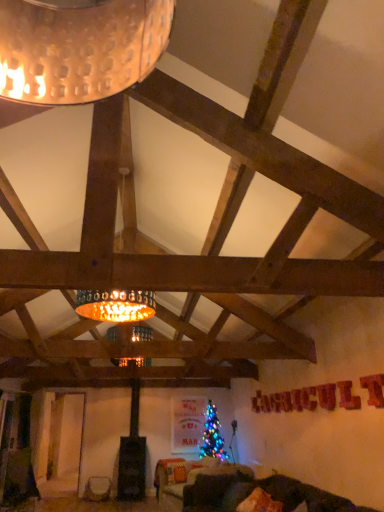
Question: Does velvet dark green couch at lower center have a larger size compared to matte white vase at lower left?

Choices:
 (A) yes
 (B) no

Answer: (A)

Question: Is velvet dark green couch at lower center outside of matte white vase at lower left?

Choices:
 (A) yes
 (B) no

Answer: (A)

Question: Does velvet dark green couch at lower center have a lesser height compared to matte white vase at lower left?

Choices:
 (A) yes
 (B) no

Answer: (B)

Question: Considering the relative positions of velvet dark green couch at lower center and matte white vase at lower left in the image provided, is velvet dark green couch at lower center to the left of matte white vase at lower left from the viewer's perspective?

Choices:
 (A) no
 (B) yes

Answer: (A)

Question: Could you tell me if velvet dark green couch at lower center is facing matte white vase at lower left?

Choices:
 (A) no
 (B) yes

Answer: (A)

Question: Relative to matte white vase at lower left, is velvet orange pillow at lower center in front or behind?

Choices:
 (A) front
 (B) behind

Answer: (A)

Question: Does point (279, 503) appear closer or farther from the camera than point (87, 500)?

Choices:
 (A) closer
 (B) farther

Answer: (A)

Question: Would you say velvet orange pillow at lower center is inside or outside matte white vase at lower left?

Choices:
 (A) outside
 (B) inside

Answer: (A)

Question: Is velvet orange pillow at lower center taller or shorter than matte white vase at lower left?

Choices:
 (A) short
 (B) tall

Answer: (A)

Question: Looking at the image, does matte white vase at lower left seem bigger or smaller compared to velvet dark green couch at lower center?

Choices:
 (A) big
 (B) small

Answer: (B)

Question: From a real-world perspective, is matte white vase at lower left positioned above or below velvet dark green couch at lower center?

Choices:
 (A) below
 (B) above

Answer: (A)

Question: In terms of width, does matte white vase at lower left look wider or thinner when compared to velvet dark green couch at lower center?

Choices:
 (A) thin
 (B) wide

Answer: (A)

Question: Considering the positions of point (104, 489) and point (206, 502), is point (104, 489) closer or farther from the camera than point (206, 502)?

Choices:
 (A) farther
 (B) closer

Answer: (A)

Question: Do you think matte white vase at lower left is within velvet orange pillow at lower center, or outside of it?

Choices:
 (A) outside
 (B) inside

Answer: (A)

Question: Considering the relative positions of matte white vase at lower left and velvet orange pillow at lower center in the image provided, is matte white vase at lower left to the left or to the right of velvet orange pillow at lower center?

Choices:
 (A) left
 (B) right

Answer: (A)